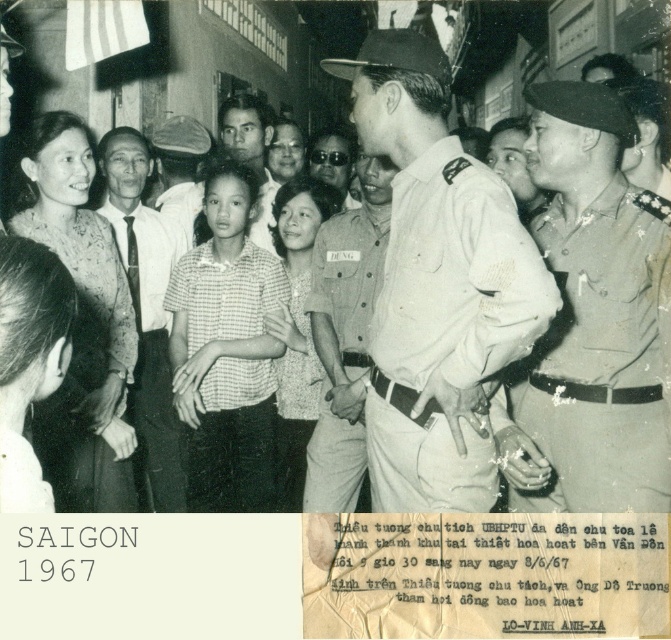
Question: Is smooth skin face at center closer to the viewer compared to matte black sunglasses at center?

Choices:
 (A) yes
 (B) no

Answer: (A)

Question: Is uniformed officer at center wider than matte black sunglasses at center?

Choices:
 (A) yes
 (B) no

Answer: (A)

Question: Does checkered fabric shirt at center appear under matte khaki uniform at center?

Choices:
 (A) no
 (B) yes

Answer: (B)

Question: Which point is closer to the camera?

Choices:
 (A) click(201, 387)
 (B) click(558, 246)
 (C) click(199, 140)

Answer: (B)

Question: Which object appears farthest from the camera in this image?

Choices:
 (A) khaki uniform shirt at center
 (B) checkered fabric blouse at center
 (C) patterned fabric blouse at left

Answer: (B)

Question: Among these points, which one is nearest to the camera?

Choices:
 (A) (180, 134)
 (B) (258, 236)

Answer: (B)